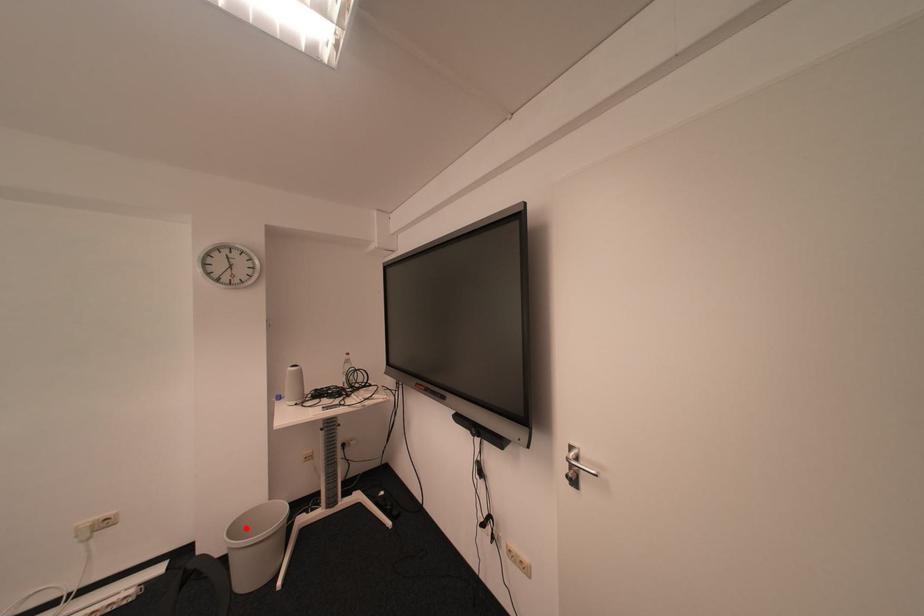
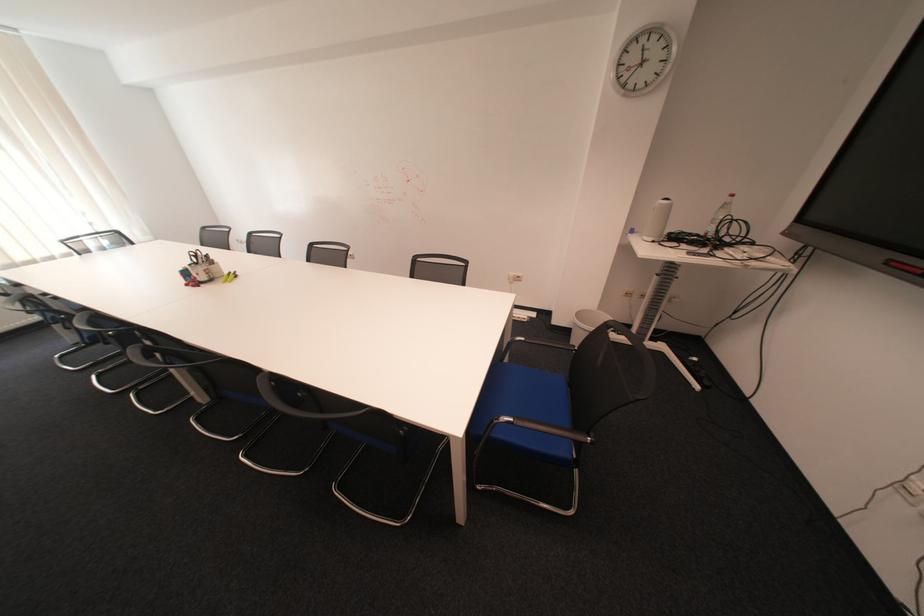
Question: A red point is marked in image1. In image2, is the corresponding 3D point closer to the camera or farther? Reply with the corresponding letter.

Choices:
 (A) The corresponding 3D point is closer.
 (B) The corresponding 3D point is farther.

Answer: (A)